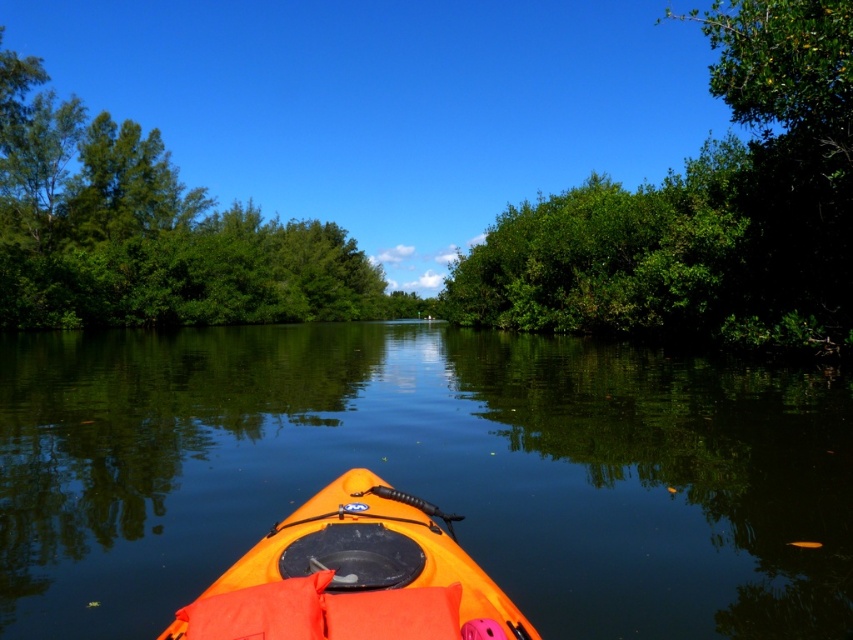
Question: Is green leafy tree at right positioned in front of orange matte kayak at center?

Choices:
 (A) yes
 (B) no

Answer: (B)

Question: Is orange kayak at center further to camera compared to green leafy tree at right?

Choices:
 (A) no
 (B) yes

Answer: (A)

Question: Which of the following is the closest to the observer?

Choices:
 (A) (219, 577)
 (B) (100, 289)
 (C) (32, 435)
 (D) (746, 29)

Answer: (A)

Question: Which of the following is the closest to the observer?

Choices:
 (A) (126, 241)
 (B) (756, 579)
 (C) (822, 289)
 (D) (341, 550)

Answer: (D)

Question: Based on their relative distances, which object is farther from the green leafy trees at left?

Choices:
 (A) orange kayak at center
 (B) green leafy tree at right

Answer: (A)

Question: Is orange kayak at center positioned behind green leafy tree at right?

Choices:
 (A) no
 (B) yes

Answer: (A)